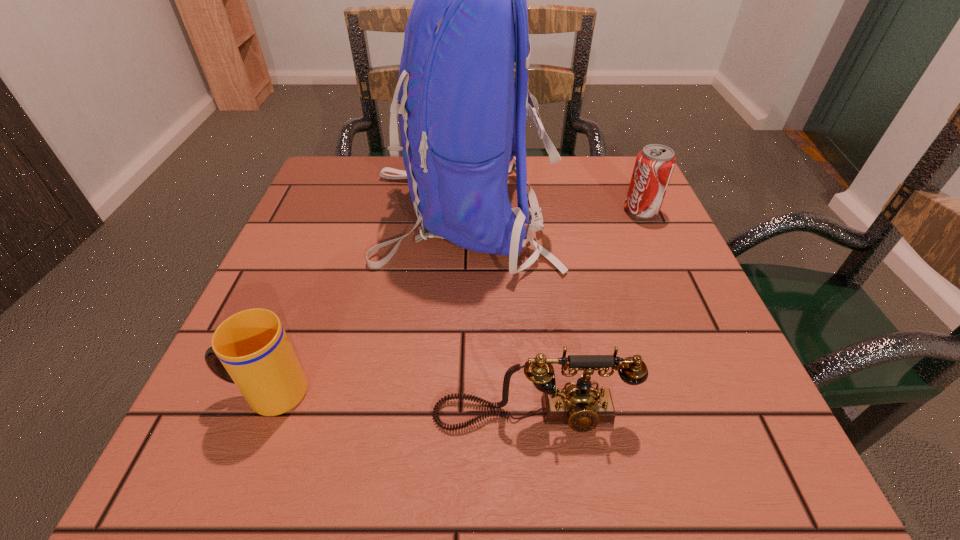
Image resolution: width=960 pixels, height=540 pixels. Identify the location of empty location between the cup and the soda can. (454, 301).

What are the coordinates of `object that stands as the third closest to the leftmost object` in the screenshot? It's located at (654, 165).

In order to click on object that stands as the second closest to the telephone in this screenshot , I will do `click(462, 120)`.

The width and height of the screenshot is (960, 540). What are the coordinates of `vacant area in the image that satisfies the following two spatial constraints: 1. on the front side of the soda can; 2. on the back of the backpack` in the screenshot? It's located at (642, 213).

Find the location of `vacant region that satisfies the following two spatial constraints: 1. on the side of the leftmost object with the handle; 2. on the left side of the rightmost object`. vacant region that satisfies the following two spatial constraints: 1. on the side of the leftmost object with the handle; 2. on the left side of the rightmost object is located at coordinates pyautogui.click(x=339, y=211).

Locate an element on the screen. The width and height of the screenshot is (960, 540). vacant position in the image that satisfies the following two spatial constraints: 1. on the side of the leftmost object with the handle; 2. on the left side of the rightmost object is located at coordinates (339, 211).